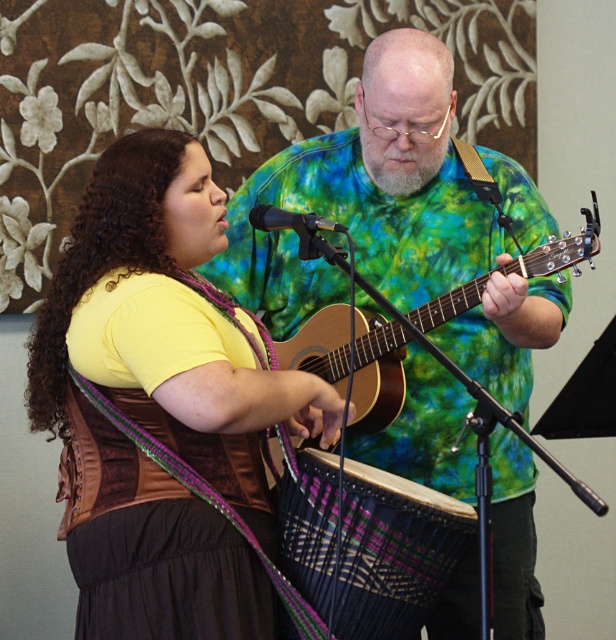
Where is the brown leather vest at center located in the image?

The brown leather vest at center is located at point 0.634 in the x coordinate and 0.263 in the y coordinate.